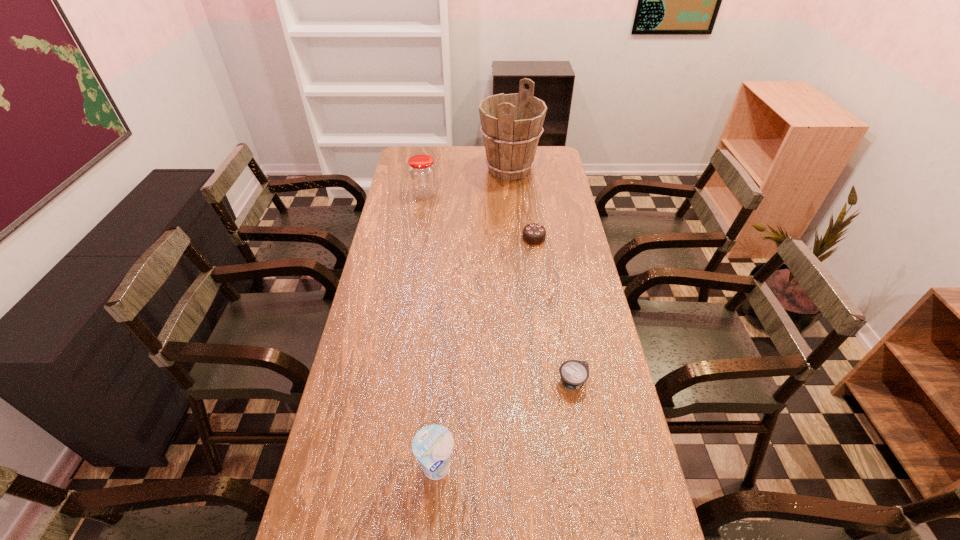
Locate an element on the screen. vacant area situated on the right of the leftmost object is located at coordinates (506, 193).

I want to click on vacant region located on the back of the left yogurt, so click(440, 424).

You are a GUI agent. You are given a task and a screenshot of the screen. Output one action in this format:
    pyautogui.click(x=<x>, y=<y>)
    Task: Click on the vacant space located 0.060m on the right of the chocolate cake
    This screenshot has width=960, height=540.
    Given the screenshot: What is the action you would take?
    pyautogui.click(x=562, y=238)

Locate an element on the screen. The image size is (960, 540). free space located 0.080m on the front of the farther yogurt is located at coordinates (580, 422).

Identify the location of object that is at the far edge. The width and height of the screenshot is (960, 540). (511, 124).

The image size is (960, 540). I want to click on object that is at the left edge, so click(x=422, y=174).

Find the location of a particular element. This screenshot has height=540, width=960. bucket present at the right edge is located at coordinates (511, 124).

The image size is (960, 540). Identify the location of chocolate cake that is positioned at the right edge. (534, 234).

Find the location of a particular element. The height and width of the screenshot is (540, 960). yogurt that is at the right edge is located at coordinates (574, 373).

Identify the location of object present at the far right corner. The image size is (960, 540). (511, 124).